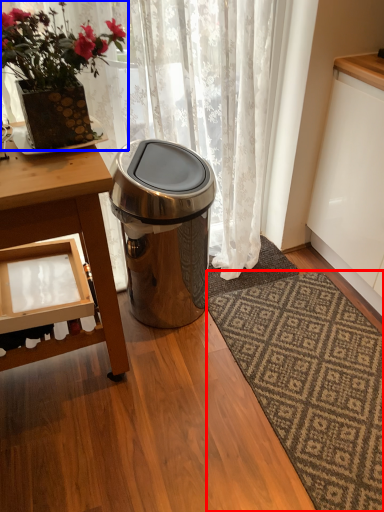
Question: Which of the following is the farthest to the observer, mat (highlighted by a red box) or houseplant (highlighted by a blue box)?

Choices:
 (A) mat
 (B) houseplant

Answer: (A)